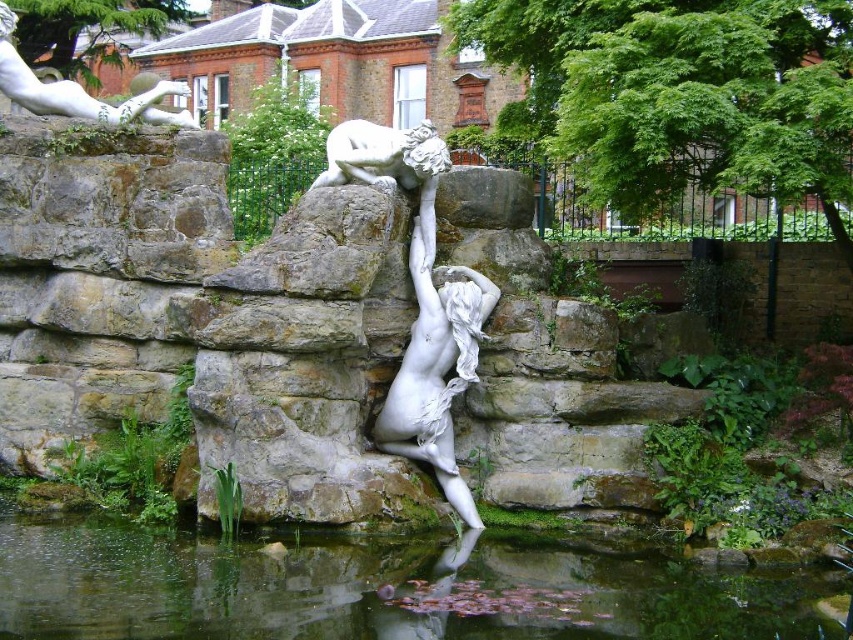
The width and height of the screenshot is (853, 640). What are the coordinates of `clear water at pond center` in the screenshot? It's located at (374, 589).

Who is more forward, (15, 570) or (126, 118)?

Point (15, 570) is more forward.

The height and width of the screenshot is (640, 853). Identify the location of clear water at pond center. (374, 589).

This screenshot has width=853, height=640. I want to click on clear water at pond center, so click(374, 589).